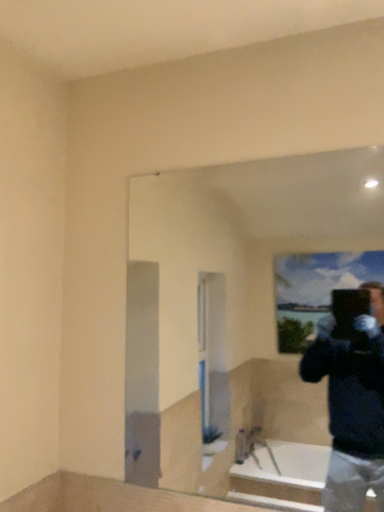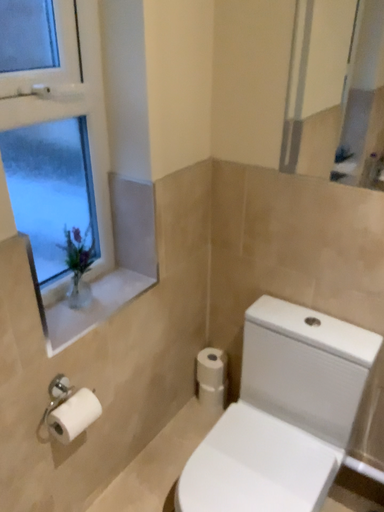
Question: Which way did the camera rotate in the video?

Choices:
 (A) rotated downward
 (B) rotated upward

Answer: (A)